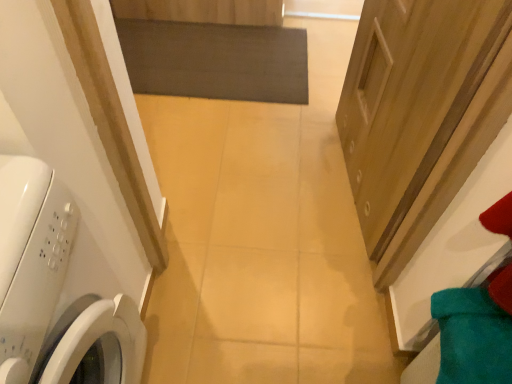
The image size is (512, 384). I want to click on vacant point above dark gray matte mat at center (from a real-world perspective), so click(218, 56).